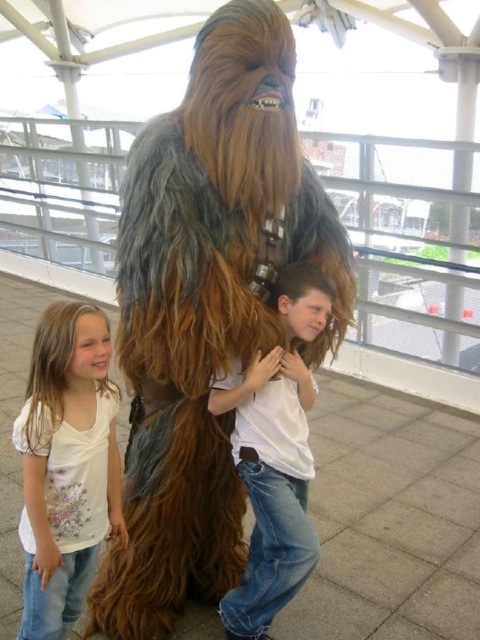
Who is lower down, white floral shirt at left or white cotton shirt at center?

white floral shirt at left

Can you confirm if white floral shirt at left is bigger than white cotton shirt at center?

Incorrect, white floral shirt at left is not larger than white cotton shirt at center.

Who is more distant from viewer, [37,444] or [295,275]?

The point [295,275] is behind.

This screenshot has width=480, height=640. I want to click on white floral shirt at left, so click(x=67, y=465).